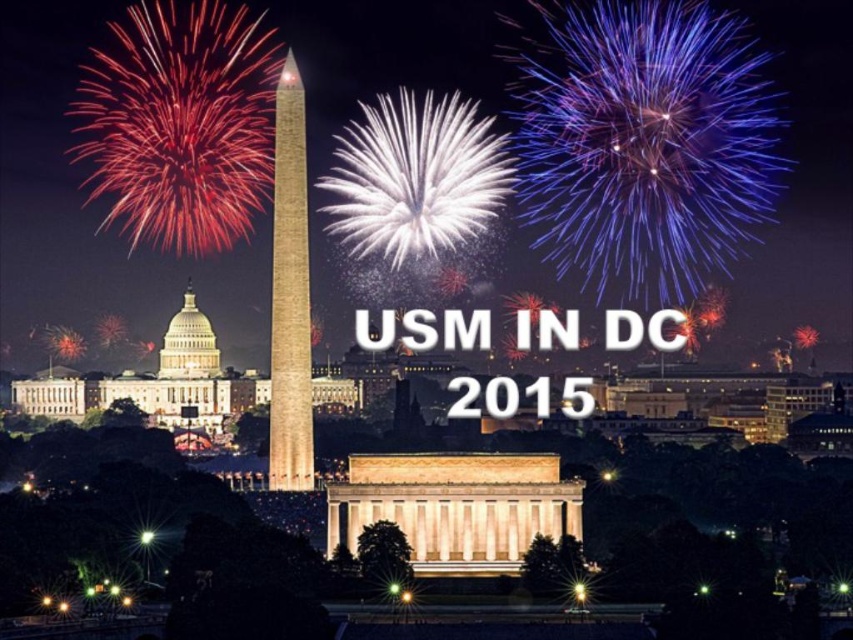
Question: Can you confirm if smooth stone monument at center is positioned to the left of white marble dome at center?

Choices:
 (A) yes
 (B) no

Answer: (B)

Question: Which point is closer to the camera taking this photo?

Choices:
 (A) (282, 131)
 (B) (190, 333)

Answer: (A)

Question: Is smooth stone monument at center to the right of white marble dome at center from the viewer's perspective?

Choices:
 (A) no
 (B) yes

Answer: (B)

Question: Which point is farther from the camera taking this photo?

Choices:
 (A) (292, 260)
 (B) (193, 300)

Answer: (B)

Question: Can you confirm if smooth stone monument at center is positioned to the right of white marble dome at center?

Choices:
 (A) yes
 (B) no

Answer: (A)